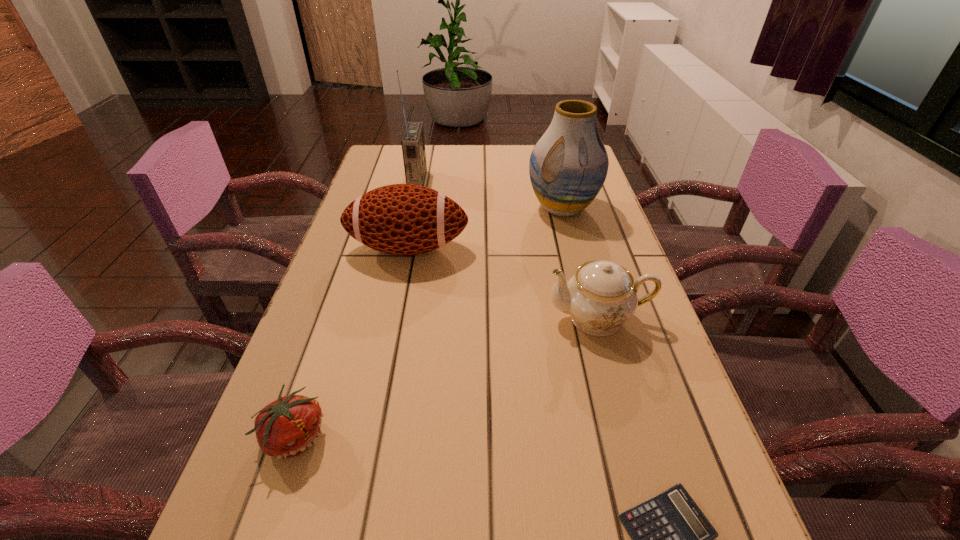
Where is `vacant space that satisfies the following two spatial constraints: 1. on the back side of the second nearest object; 2. on the left side of the fourth nearest object`? Image resolution: width=960 pixels, height=540 pixels. vacant space that satisfies the following two spatial constraints: 1. on the back side of the second nearest object; 2. on the left side of the fourth nearest object is located at coordinates (359, 248).

The width and height of the screenshot is (960, 540). I want to click on blank area in the image that satisfies the following two spatial constraints: 1. on the display of the vase; 2. on the right side of the radio receiver, so 411,208.